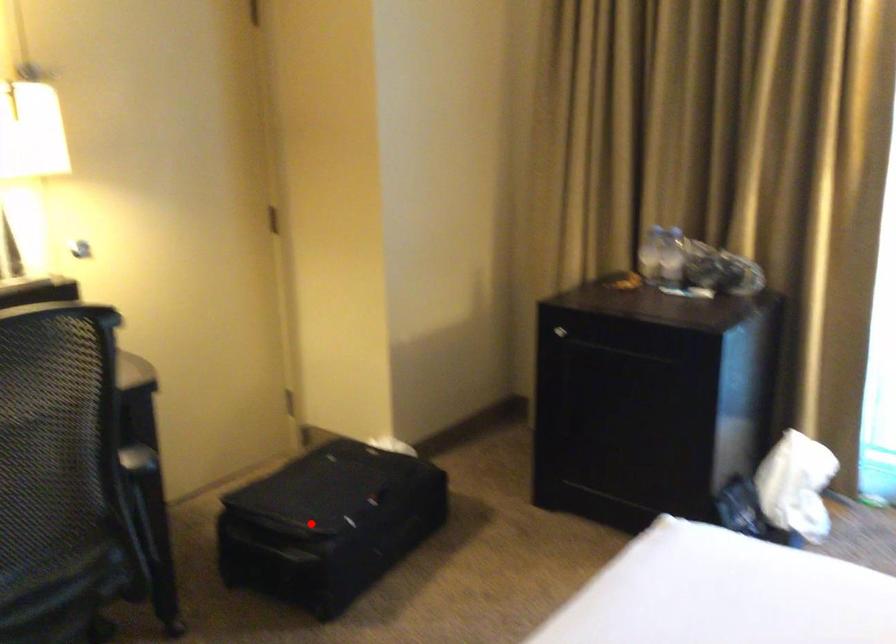
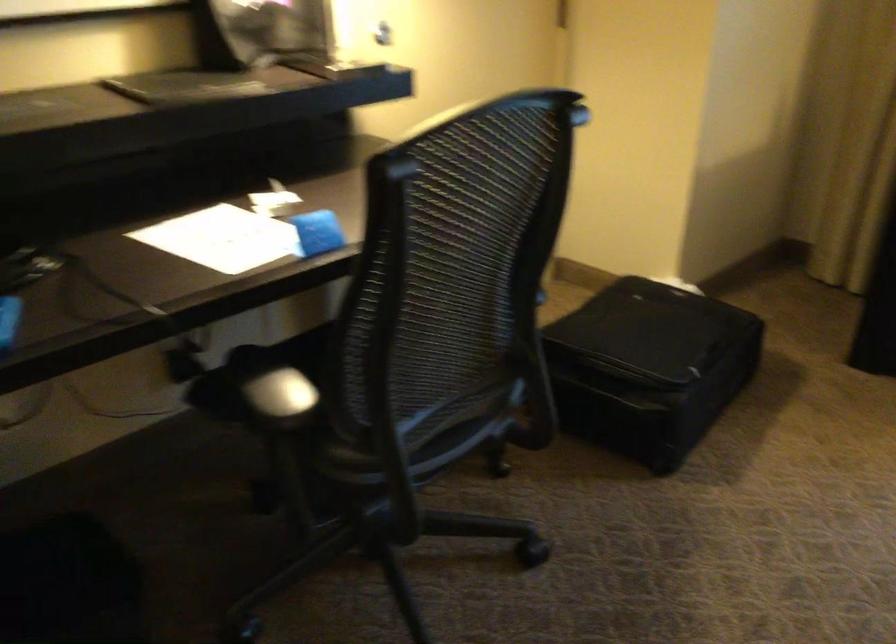
Question: A red point is marked in image1. In image2, is the corresponding 3D point closer to the camera or farther? Reply with the corresponding letter.

Choices:
 (A) The corresponding 3D point is closer.
 (B) The corresponding 3D point is farther.

Answer: (A)